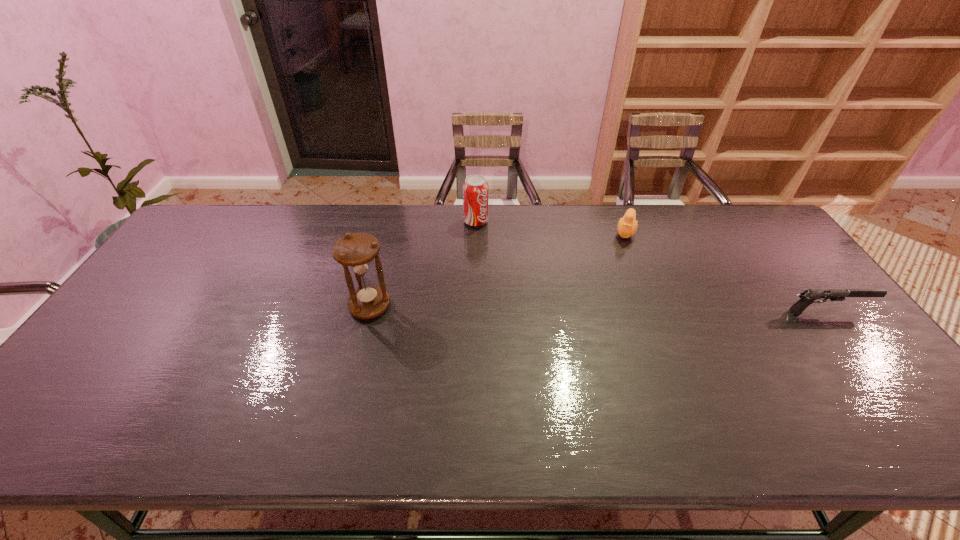
Where is `vacant space at the far left corner of the desktop`? This screenshot has width=960, height=540. vacant space at the far left corner of the desktop is located at coordinates (246, 204).

Locate an element on the screen. This screenshot has height=540, width=960. free spot between the second object from right to left and the gun is located at coordinates (726, 272).

What are the coordinates of `free spot between the leftmost object and the soda can` in the screenshot? It's located at (422, 264).

I want to click on free space between the rightmost object and the hourglass, so click(598, 309).

The height and width of the screenshot is (540, 960). I want to click on empty location between the third object from right to left and the third object from left to right, so click(x=551, y=226).

The image size is (960, 540). In order to click on vacant space that's between the duckling and the second tallest object in this screenshot , I will do `click(551, 226)`.

At what (x,y) coordinates should I click in order to perform the action: click on vacant point located between the hourglass and the third object from left to right. Please return your answer as a coordinate pair (x, y). Looking at the image, I should click on (497, 269).

Where is `free space that is in between the second object from right to left and the hourglass`? This screenshot has height=540, width=960. free space that is in between the second object from right to left and the hourglass is located at coordinates (497, 269).

The width and height of the screenshot is (960, 540). I want to click on unoccupied area between the rightmost object and the hourglass, so click(598, 309).

The height and width of the screenshot is (540, 960). Identify the location of free space between the second object from right to left and the gun. (726, 272).